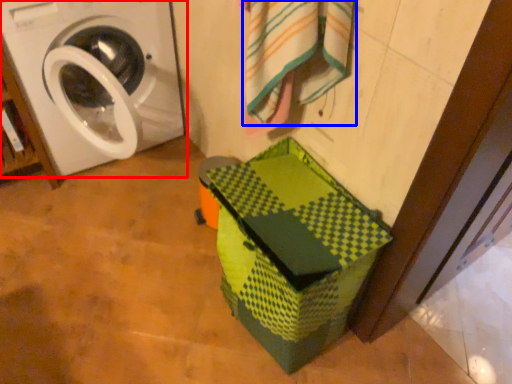
Question: Which of the following is the closest to the observer, washing machine (highlighted by a red box) or bath towel (highlighted by a blue box)?

Choices:
 (A) washing machine
 (B) bath towel

Answer: (B)